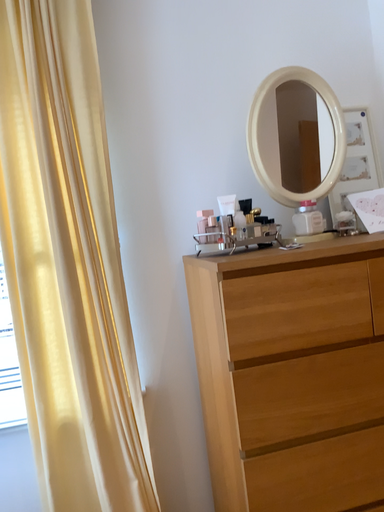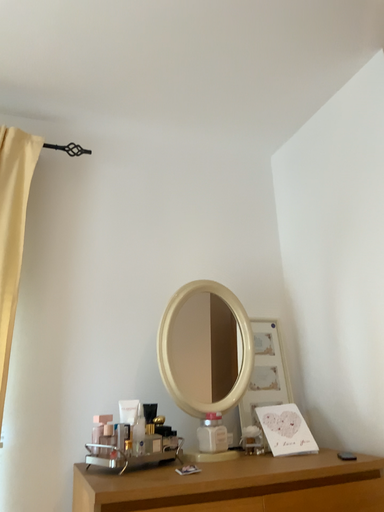
Question: Which way did the camera rotate in the video?

Choices:
 (A) rotated upward
 (B) rotated downward

Answer: (A)